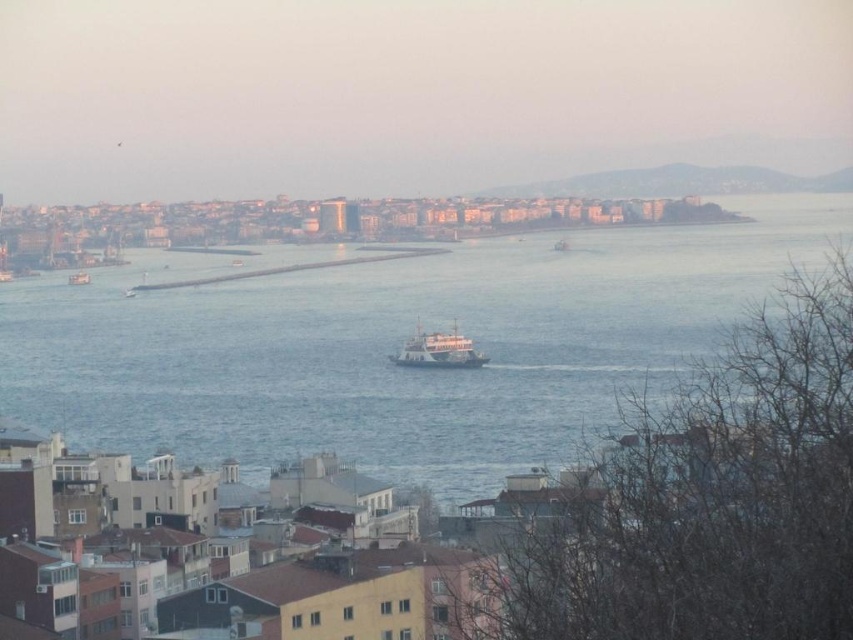
Consider the image. You are a tourist standing at the coast and see the white matte ferry at center and the white matte boat at left. Which one is positioned more to the right side of the scene?

The white matte ferry at center is positioned more to the right side of the scene than the white matte boat at left.

You are standing at the edge of the coastal area and want to take a photo of the blue water at center. Where should you position yourself to capture it in the frame?

The blue water at center is located at point (x=393, y=344), so you should position yourself directly facing the center of the scene to capture it in the frame.